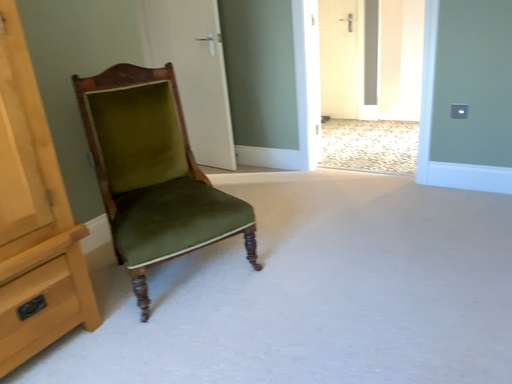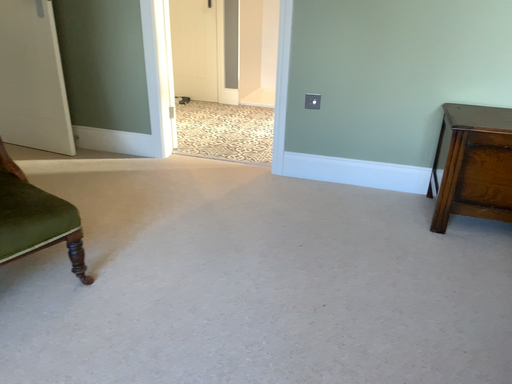
Question: How did the camera likely rotate when shooting the video?

Choices:
 (A) rotated right
 (B) rotated left

Answer: (A)